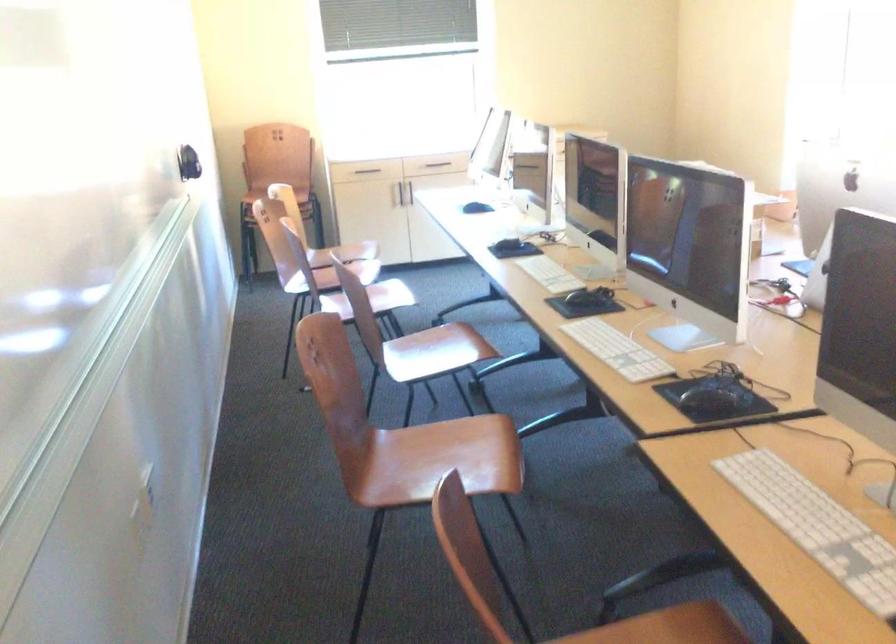
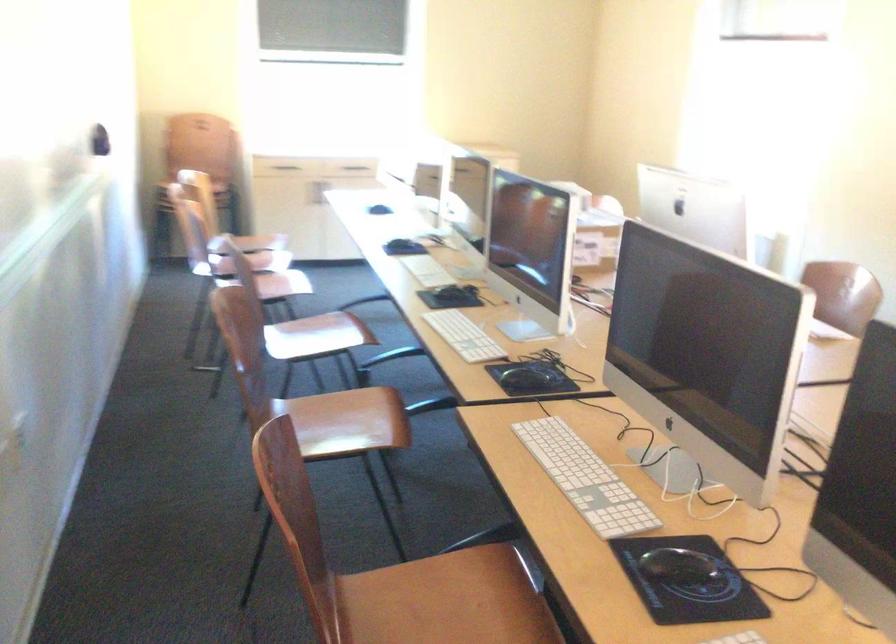
Question: The camera is either moving clockwise (left) or counter-clockwise (right) around the object. The first image is from the beginning of the video and the second image is from the end. Is the camera moving left or right when shooting the video?

Choices:
 (A) Left
 (B) Right

Answer: (A)